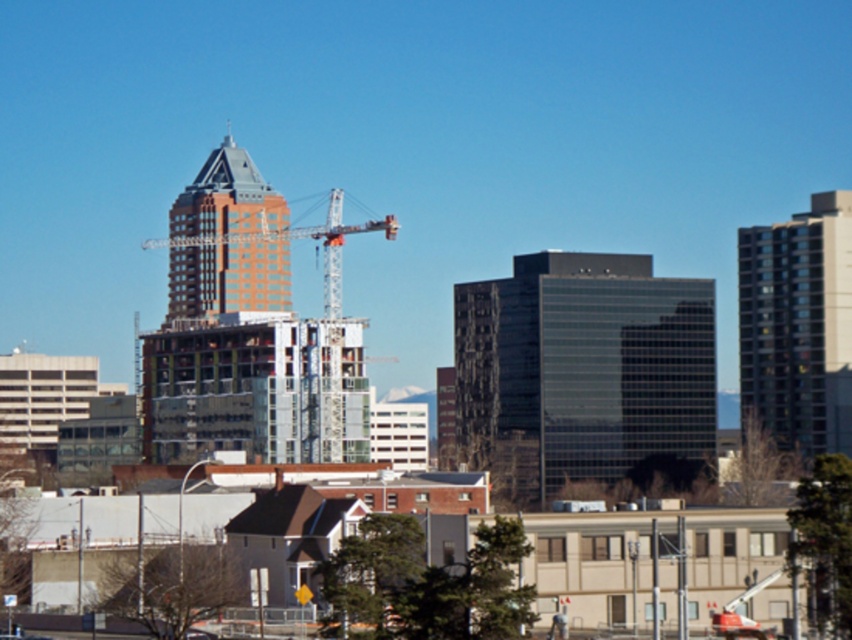
Question: Can you confirm if dark gray glass building at right is wider than metallic silver crane at center?

Choices:
 (A) yes
 (B) no

Answer: (B)

Question: Considering the real-world distances, which object is closest to the matte glass skyscraper at center?

Choices:
 (A) black glass building at center
 (B) dark gray glass building at right
 (C) metallic silver helmet at lower center

Answer: (A)

Question: Among these points, which one is nearest to the camera?

Choices:
 (A) (521, 340)
 (B) (367, 224)
 (C) (258, 225)
 (D) (772, 342)

Answer: (A)

Question: Does black glass building at center come behind metallic silver crane at center?

Choices:
 (A) no
 (B) yes

Answer: (A)

Question: Which point is farther to the camera?

Choices:
 (A) matte glass skyscraper at center
 (B) dark gray glass building at right
 (C) black glass building at center

Answer: (B)

Question: Is matte glass skyscraper at center below metallic silver crane at center?

Choices:
 (A) yes
 (B) no

Answer: (B)